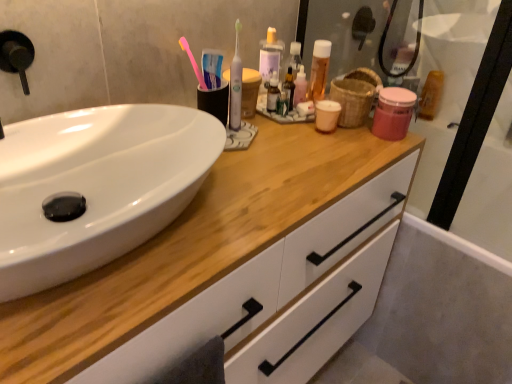
Locate an element on the screen. The height and width of the screenshot is (384, 512). vacant space in front of white glossy toothbrush at center, which is counted as the 1th toothbrush, starting from the right is located at coordinates (257, 170).